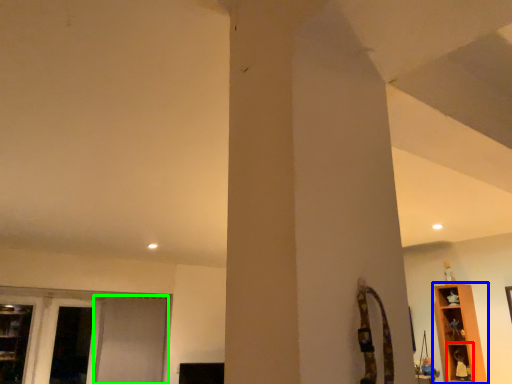
Question: Considering the real-world distances, which object is farthest from shelf (highlighted by a red box)? shelf (highlighted by a blue box) or screen door (highlighted by a green box)?

Choices:
 (A) shelf
 (B) screen door

Answer: (B)